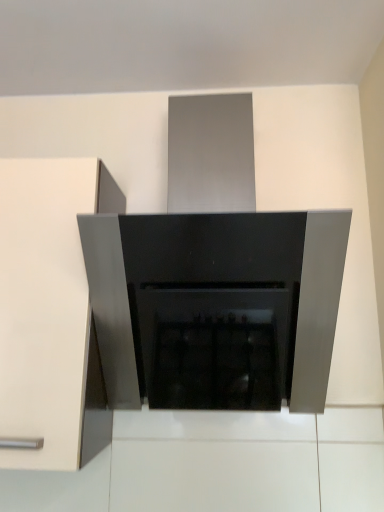
Locate an element on the screen. white glossy cabinet at left is located at coordinates (50, 312).

The width and height of the screenshot is (384, 512). What do you see at coordinates (50, 312) in the screenshot?
I see `white glossy cabinet at left` at bounding box center [50, 312].

Image resolution: width=384 pixels, height=512 pixels. I want to click on white glossy cabinet at left, so click(50, 312).